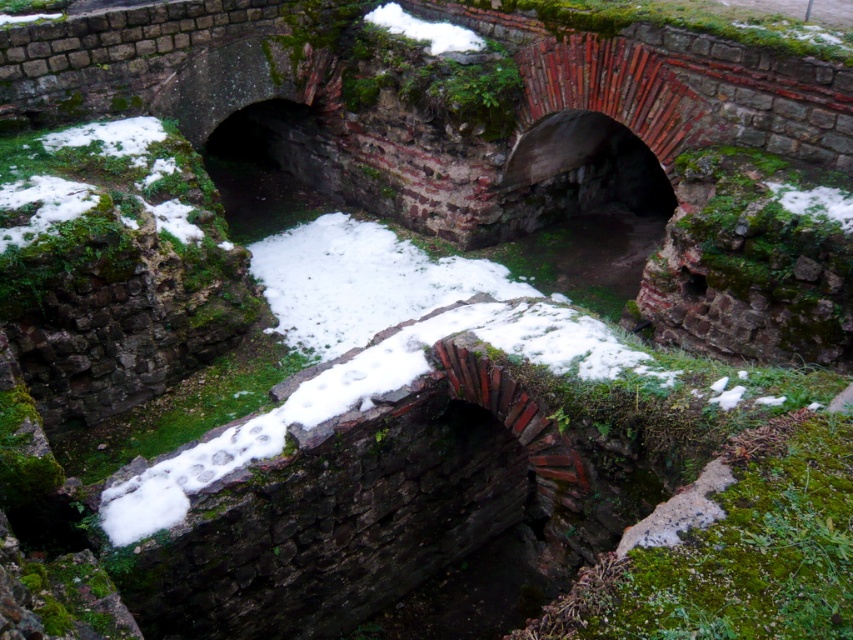
Question: Among these objects, which one is nearest to the camera?

Choices:
 (A) white fluffy snow at center
 (B) white fluffy snow at lower right

Answer: (A)

Question: Based on their relative distances, which object is nearer to the white fluffy snow at lower right?

Choices:
 (A) white fluffy snow at upper center
 (B) white fluffy snow at center

Answer: (B)

Question: In this image, where is white fluffy snow at upper center located relative to white fluffy snow at lower right?

Choices:
 (A) below
 (B) above

Answer: (B)

Question: Which object is positioned farthest from the white fluffy snow at upper center?

Choices:
 (A) white fluffy snow at lower right
 (B) white fluffy snow at center

Answer: (B)

Question: Is white fluffy snow at upper center wider than white fluffy snow at lower right?

Choices:
 (A) yes
 (B) no

Answer: (A)

Question: Does white fluffy snow at center have a lesser width compared to white fluffy snow at upper center?

Choices:
 (A) no
 (B) yes

Answer: (A)